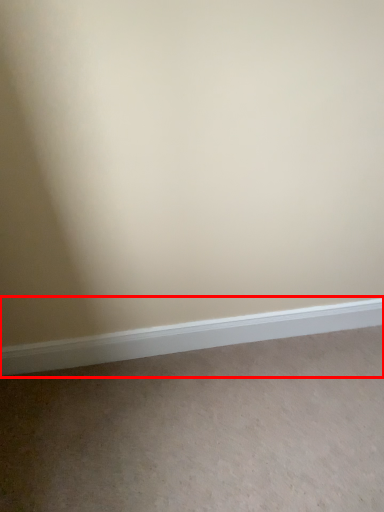
Question: From the image's perspective, what is the correct spatial positioning of window sill (annotated by the red box) in reference to plain?

Choices:
 (A) above
 (B) below

Answer: (A)